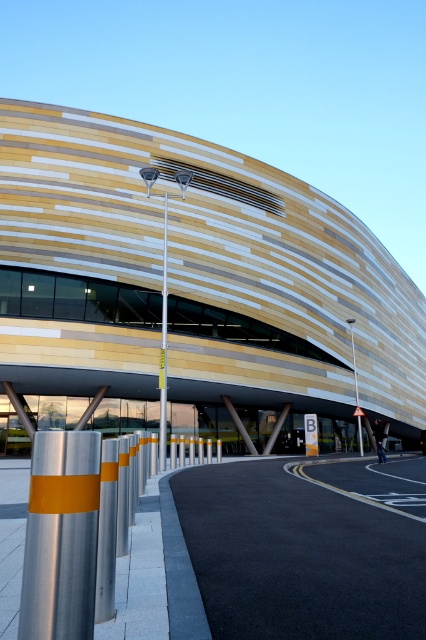
Looking at this image, you are standing in front of the modern building and want to determine the relative positions of two points marked in the scene. Which point is closer to you, point 1 at coordinates (285,193) or point 2 at coordinates (359,422)?

Point 1 at coordinates (285,193) is closer to the viewer than point 2 at coordinates (359,422) according to the description.

You are standing in front of the modern building and looking at two points marked on the ground. The first point is at coordinates point (25, 236) and the second is at point (351, 627). Which point is closer to your current position?

Point (25, 236) is closer to your current position because it is further to the camera than point (351, 627), meaning it is physically nearer to where you are standing.

You are a maintenance worker needing to inspect both the wooden paneling at center and the metallic pole at center. Based on their positions, which one should you check first if you start from ground level?

Answer: The metallic pole at center should be checked first since it is located below the wooden paneling at center, making it accessible from the ground level before the higher wooden paneling.